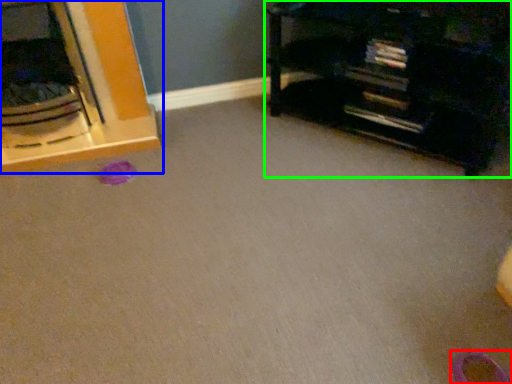
Question: Estimate the real-world distances between objects in this image. Which object is farther from shoe (highlighted by a red box), furniture (highlighted by a blue box) or furniture (highlighted by a green box)?

Choices:
 (A) furniture
 (B) furniture

Answer: (A)